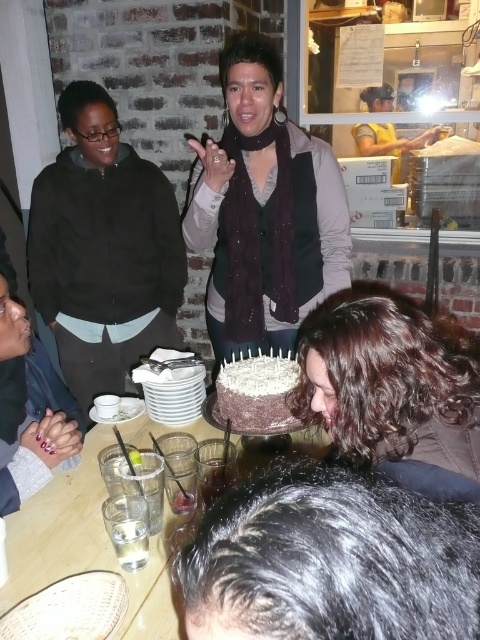
Question: Does dark brown curly hair at lower center have a larger size compared to wooden table at center?

Choices:
 (A) yes
 (B) no

Answer: (B)

Question: Which object is the closest to the matte black jacket at left?

Choices:
 (A) wooden table at center
 (B) matte black scarf at center

Answer: (B)

Question: Which of the following is the farthest from the observer?

Choices:
 (A) (219, 300)
 (B) (410, 355)
 (C) (167, 570)

Answer: (A)

Question: Is matte black jacket at left below chocolate frosted cake at center?

Choices:
 (A) yes
 (B) no

Answer: (B)

Question: Which point is farther to the camera?

Choices:
 (A) (282, 416)
 (B) (76, 180)

Answer: (B)

Question: Observing the image, what is the correct spatial positioning of matte black jacket at left in reference to dark brown curly hair at lower center?

Choices:
 (A) left
 (B) right

Answer: (A)